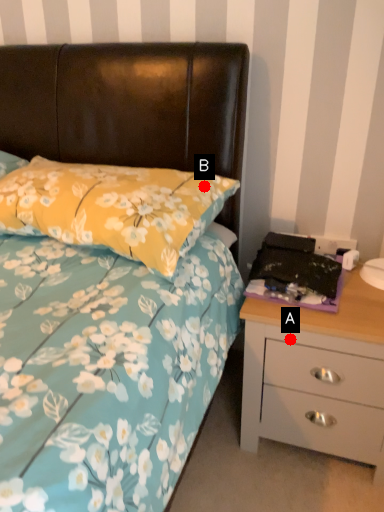
Question: Two points are circled on the image, labeled by A and B beside each circle. Which point is closer to the camera?

Choices:
 (A) A is closer
 (B) B is closer

Answer: (A)